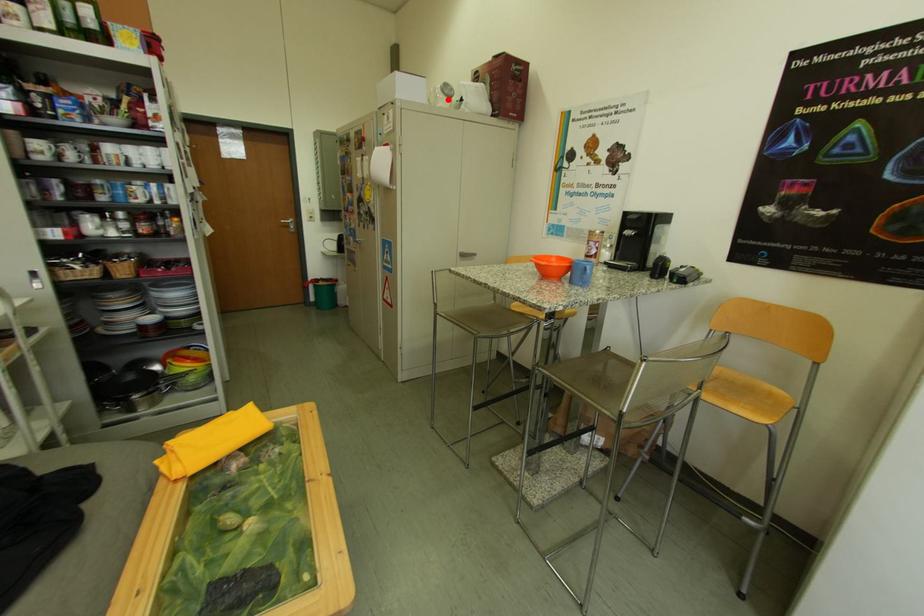
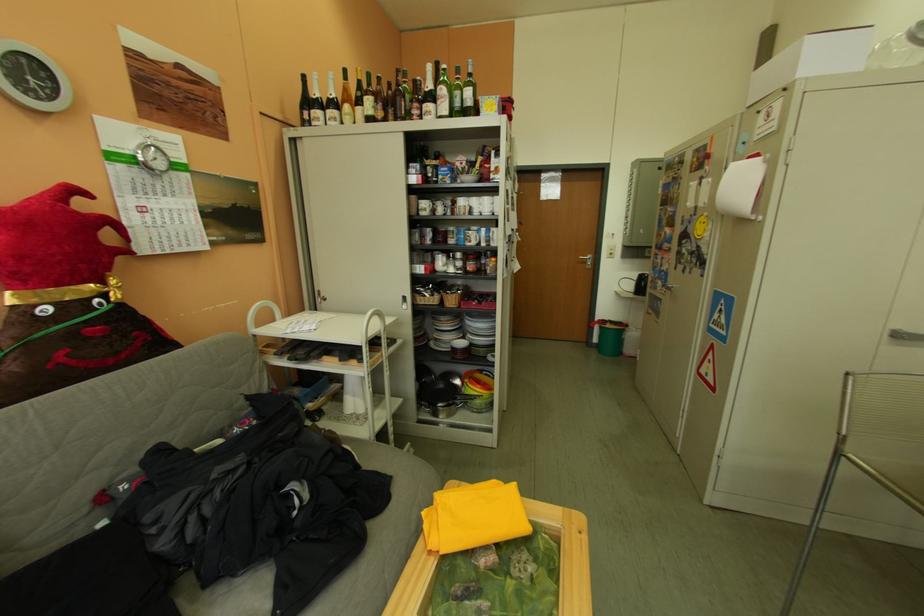
Question: I am providing you with two images of the same scene from different viewpoints. A red point is shown in image1. For the corresponding object point in image2, is it positioned nearer or farther from the camera?

Choices:
 (A) Nearer
 (B) Farther

Answer: (B)